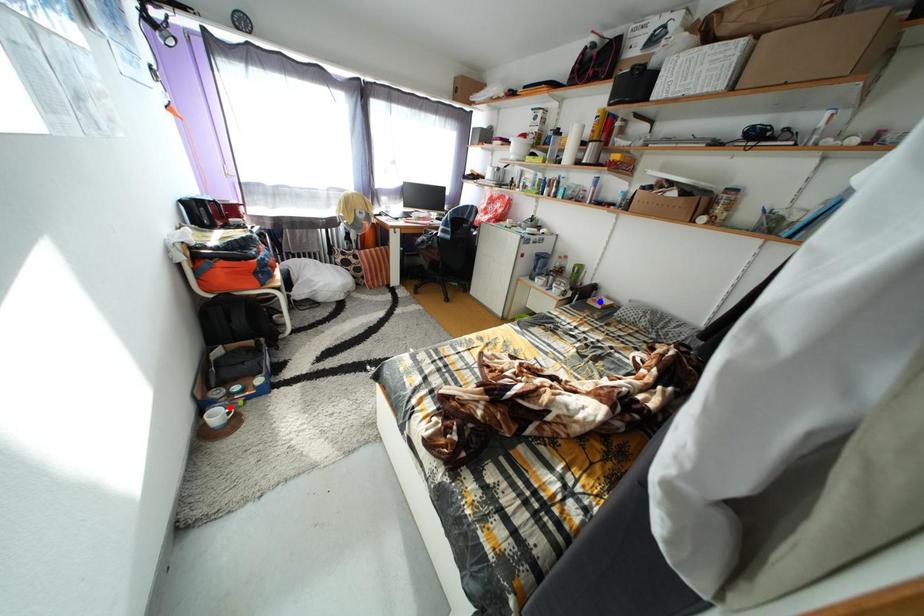
Question: Two points are marked on the image. Which point is closer to the camera?

Choices:
 (A) Blue point is closer.
 (B) Red point is closer.

Answer: (B)